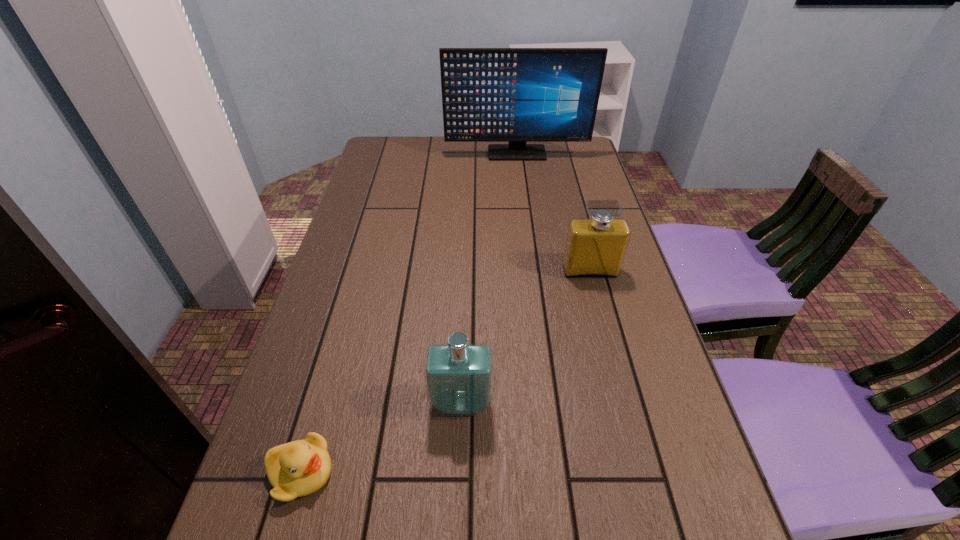
The image size is (960, 540). Find the location of `computer monitor`. computer monitor is located at coordinates (517, 95).

Find the location of a particular element. The height and width of the screenshot is (540, 960). the tallest object is located at coordinates (517, 95).

Locate an element on the screen. the third nearest object is located at coordinates (595, 247).

At what (x,y) coordinates should I click in order to perform the action: click on the farther perfume. Please return your answer as a coordinate pair (x, y). This screenshot has height=540, width=960. Looking at the image, I should click on (595, 247).

This screenshot has height=540, width=960. I want to click on the left perfume, so click(x=458, y=375).

Locate an element on the screen. This screenshot has width=960, height=540. the nearer perfume is located at coordinates (458, 375).

At what (x,y) coordinates should I click in order to perform the action: click on the shortest object. Please return your answer as a coordinate pair (x, y). This screenshot has width=960, height=540. Looking at the image, I should click on (299, 468).

Image resolution: width=960 pixels, height=540 pixels. Identify the location of the nearest object. [299, 468].

I want to click on vacant region located 0.170m on the screen side of the tallest object, so click(520, 187).

Locate an element on the screen. free space located 0.260m on the front-facing side of the second farthest object is located at coordinates (614, 364).